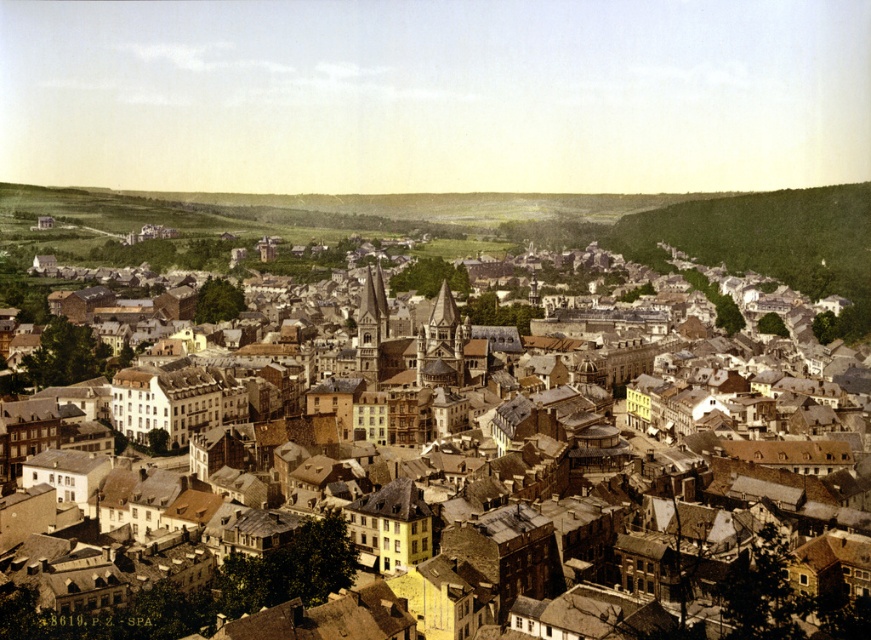
You are an architect analyzing this historic town. You need to locate the brown stone buildings at center for your study. According to the coordinates provided, where exactly would you find them in the image?

The brown stone buildings at center are located at coordinates point (199, 593).

You are an architect analyzing the layout of this historic town. Based on the image, which object is positioned to the left of the other between the brown stone buildings at center and the green grassy hillside at upper right?

The brown stone buildings at center are positioned to the left of the green grassy hillside at upper right.

Based on the photo, you are an urban planner analyzing the town layout. Based on the scene, which area covers a larger portion of the image between the brown stone buildings at center and the green grassy hillside at upper right?

The green grassy hillside at upper right covers a larger portion of the image than the brown stone buildings at center, as it occupies more space according to the description.